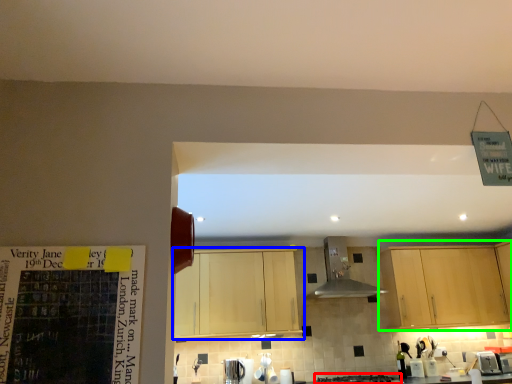
Question: Which object is positioned closest to gas stove (highlighted by a red box)? Select from cabinetry (highlighted by a blue box) and cabinetry (highlighted by a green box).

Choices:
 (A) cabinetry
 (B) cabinetry

Answer: (B)